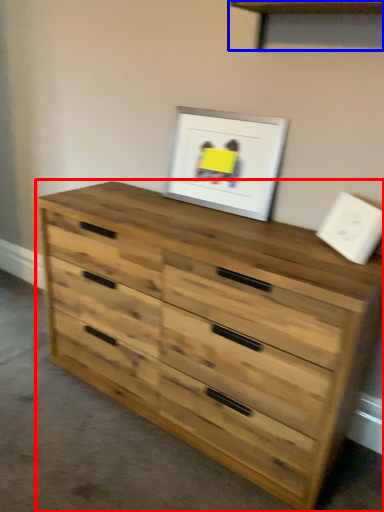
Question: Which object appears farthest to the camera in this image, chest of drawers (highlighted by a red box) or shelf (highlighted by a blue box)?

Choices:
 (A) chest of drawers
 (B) shelf

Answer: (B)